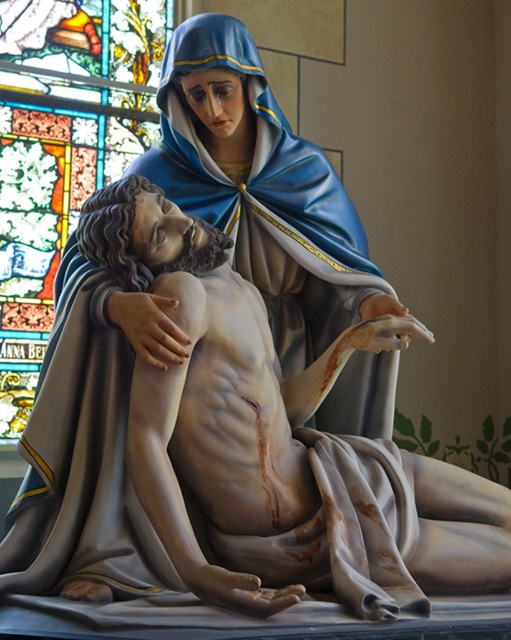
You are an art conservator examining the religious sculpture. You notice the matte gray statue at center and the stained glass at upper left. Which object is located to the right of the other?

The matte gray statue at center is positioned on the right side of stained glass at upper left, so the matte gray statue at center is to the right of the stained glass at upper left.

You are an art conservator assessing the space in a gallery. You need to determine if the matte gray statue at center can be moved to the location currently occupied by the stained glass at upper left. Based on their sizes, is this feasible?

The matte gray statue at center has a smaller size compared to stained glass at upper left, so it can be moved to the location of the stained glass at upper left as it will fit in the space.

What is the significance of the point at coordinates (236, 452) in the religious sculpture?

The point at coordinates (236, 452) indicates the location of the matte gray statue at center in the religious sculpture.